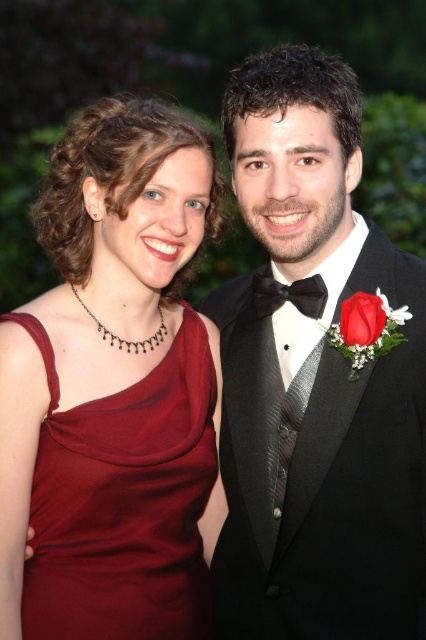
Question: Which object is farther from the camera taking this photo?

Choices:
 (A) black satin bow tie at center
 (B) red velvet rose at center

Answer: (A)

Question: Which point is closer to the camera taking this photo?

Choices:
 (A) (382, 300)
 (B) (273, 499)
 (C) (255, 284)

Answer: (A)

Question: Can you confirm if burgundy satin dress at left is positioned to the left of red velvet rose at center?

Choices:
 (A) yes
 (B) no

Answer: (A)

Question: Is red velvet rose at center to the left of black satin bow tie at center from the viewer's perspective?

Choices:
 (A) yes
 (B) no

Answer: (B)

Question: Which object is farther from the camera taking this photo?

Choices:
 (A) burgundy satin dress at left
 (B) red velvet rose at center
 (C) black satin tuxedo at right

Answer: (C)

Question: Can you confirm if black satin tuxedo at right is positioned above black satin bow tie at center?

Choices:
 (A) no
 (B) yes

Answer: (A)